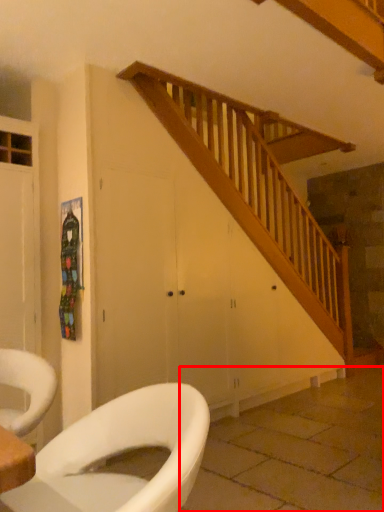
Question: In this image, where is tile (annotated by the red box) located relative to toilet?

Choices:
 (A) left
 (B) right

Answer: (B)